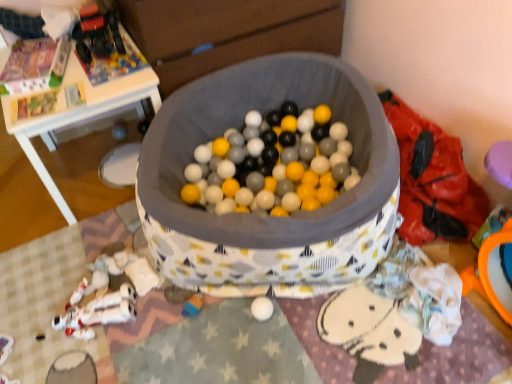
Identify the location of free space behind white matte plastic toy at lower left, the 3th toy positioned from the bottom. (112, 236).